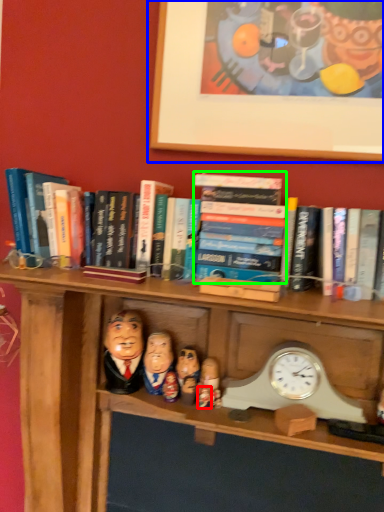
Question: Which is nearer to the toy (highlighted by a red box)? picture frame (highlighted by a blue box) or paperback book (highlighted by a green box).

Choices:
 (A) picture frame
 (B) paperback book

Answer: (B)